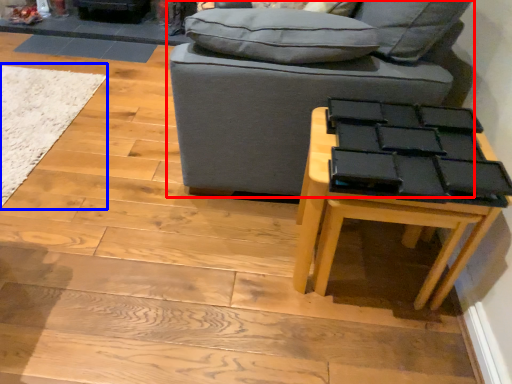
Question: Which of the following is the farthest to the observer, studio couch (highlighted by a red box) or mat (highlighted by a blue box)?

Choices:
 (A) studio couch
 (B) mat

Answer: (B)